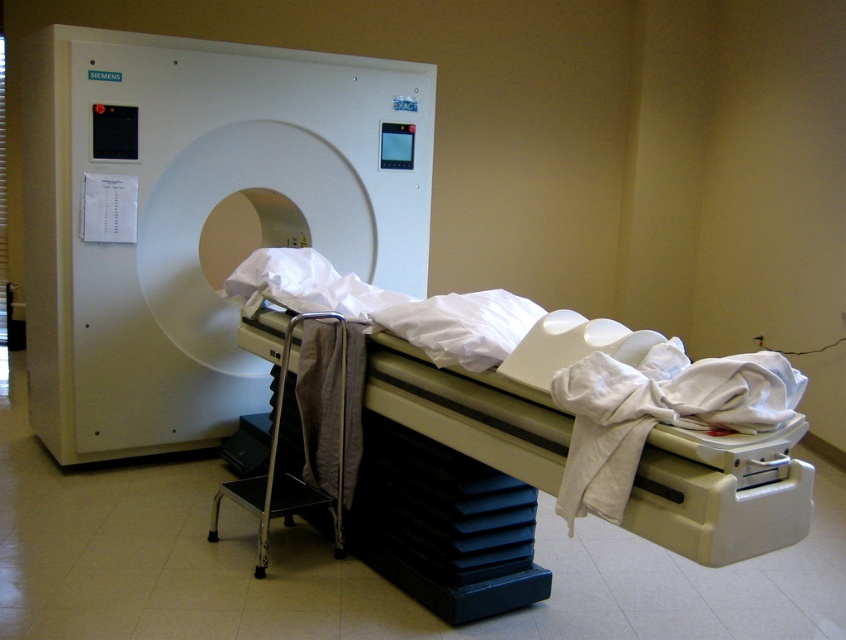
Can you confirm if white fabric bed at center is taller than white matte cloth at lower right?

Correct, white fabric bed at center is much taller as white matte cloth at lower right.

Is point (338, 355) less distant than point (646, 406)?

No, it is not.

Describe the element at coordinates (405, 403) in the screenshot. The width and height of the screenshot is (846, 640). I see `white fabric bed at center` at that location.

Identify the location of white fabric bed at center. (405, 403).